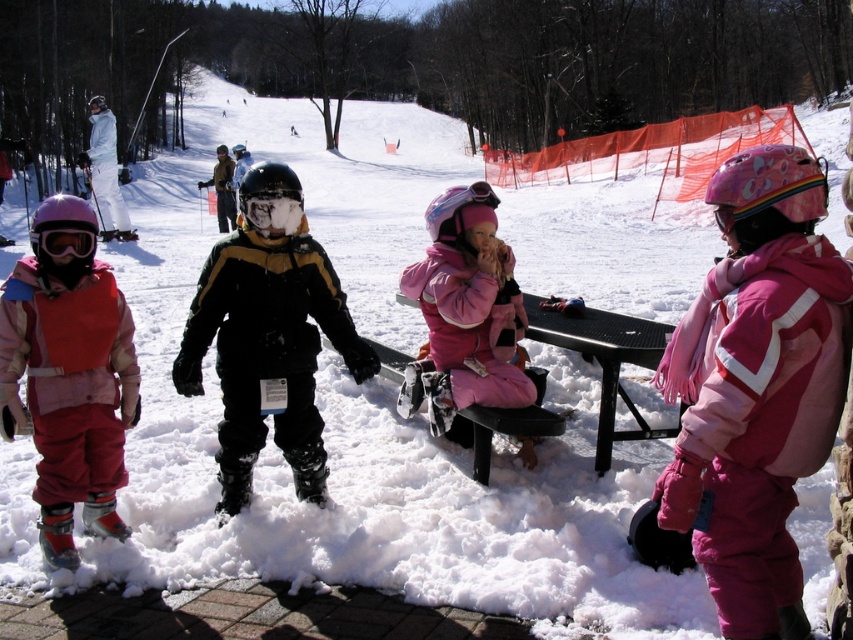
The width and height of the screenshot is (853, 640). Describe the element at coordinates (465, 312) in the screenshot. I see `pink matte snowsuit at center` at that location.

You are a GUI agent. You are given a task and a screenshot of the screen. Output one action in this format:
    pyautogui.click(x=<x>, y=<y>)
    Task: Click on the pink matte snowsuit at center
    
    Given the screenshot: What is the action you would take?
    pyautogui.click(x=465, y=312)

Which is behind, point (448, 368) or point (59, 253)?

Positioned behind is point (448, 368).

The height and width of the screenshot is (640, 853). Find the location of `pink matte snowsuit at center`. pink matte snowsuit at center is located at coordinates (465, 312).

How distant is black metal picnic table at center from matte black goggles at left?

The distance of black metal picnic table at center from matte black goggles at left is 8.83 feet.

Between black metal picnic table at center and matte black goggles at left, which one has more height?

black metal picnic table at center is taller.

What do you see at coordinates (604, 360) in the screenshot? The image size is (853, 640). I see `black metal picnic table at center` at bounding box center [604, 360].

I want to click on black metal picnic table at center, so click(x=604, y=360).

This screenshot has height=640, width=853. What do you see at coordinates (68, 380) in the screenshot? I see `matte pink snowsuit at left` at bounding box center [68, 380].

Between matte pink snowsuit at left and pink matte snowsuit at center, which one appears on the left side from the viewer's perspective?

matte pink snowsuit at left

Is point (9, 362) farther from viewer compared to point (465, 371)?

No, it is not.

Where is `matte pink snowsuit at left`? The image size is (853, 640). matte pink snowsuit at left is located at coordinates (68, 380).